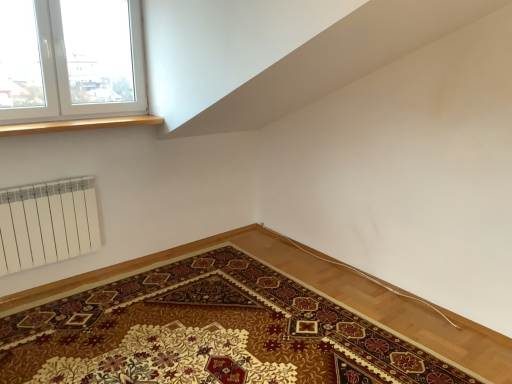
Question: Considering the relative positions of white plastic window at upper left and carpeted mat at lower left in the image provided, is white plastic window at upper left to the left of carpeted mat at lower left from the viewer's perspective?

Choices:
 (A) yes
 (B) no

Answer: (A)

Question: Is white plastic window at upper left far away from carpeted mat at lower left?

Choices:
 (A) yes
 (B) no

Answer: (A)

Question: Does white plastic window at upper left have a lesser width compared to carpeted mat at lower left?

Choices:
 (A) no
 (B) yes

Answer: (B)

Question: Is carpeted mat at lower left completely or partially inside white plastic window at upper left?

Choices:
 (A) yes
 (B) no

Answer: (B)

Question: Can you confirm if white plastic window at upper left is bigger than carpeted mat at lower left?

Choices:
 (A) yes
 (B) no

Answer: (B)

Question: From a real-world perspective, is white plastic window at upper left located higher than carpeted mat at lower left?

Choices:
 (A) yes
 (B) no

Answer: (A)

Question: From the image's perspective, is wooden at upper left located above white plastic window at upper left?

Choices:
 (A) yes
 (B) no

Answer: (B)

Question: Does wooden at upper left appear on the left side of white plastic window at upper left?

Choices:
 (A) yes
 (B) no

Answer: (B)

Question: Considering the relative sizes of wooden at upper left and white plastic window at upper left in the image provided, is wooden at upper left shorter than white plastic window at upper left?

Choices:
 (A) yes
 (B) no

Answer: (A)

Question: Is wooden at upper left not near white plastic window at upper left?

Choices:
 (A) yes
 (B) no

Answer: (B)

Question: Does wooden at upper left have a smaller size compared to white plastic window at upper left?

Choices:
 (A) yes
 (B) no

Answer: (A)

Question: Is wooden at upper left wider than white plastic window at upper left?

Choices:
 (A) no
 (B) yes

Answer: (B)

Question: From the image's perspective, does carpeted mat at lower left appear higher than wooden at upper left?

Choices:
 (A) yes
 (B) no

Answer: (B)